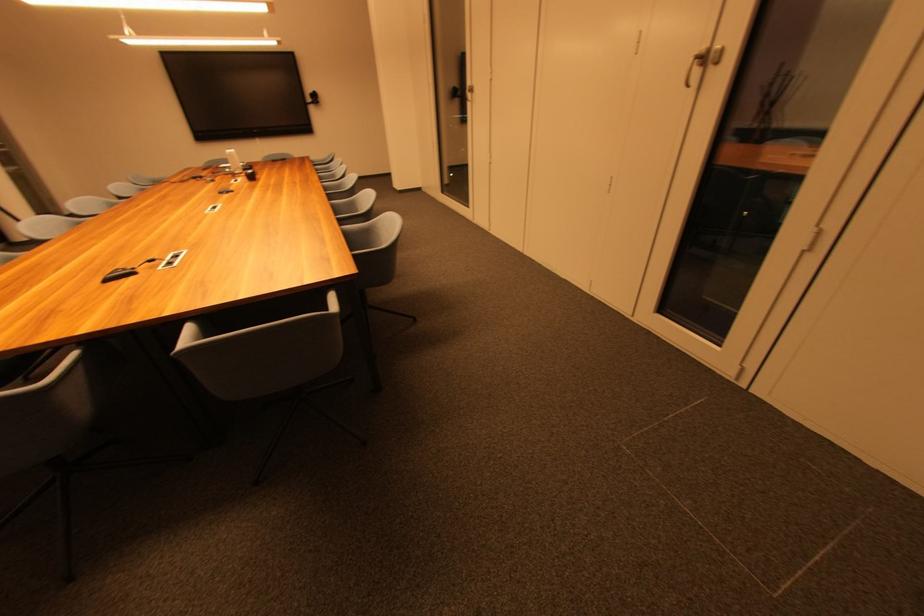
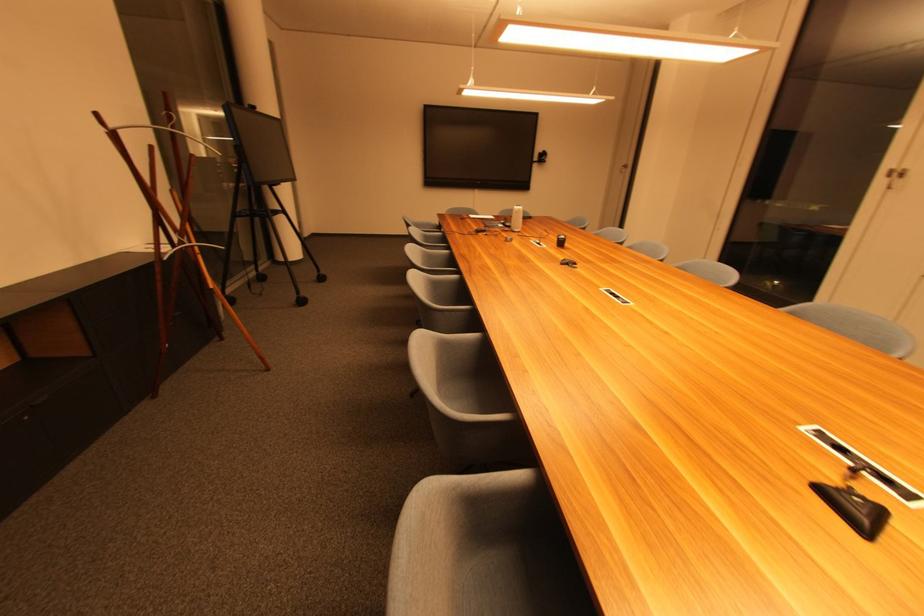
Find the pixel in the second image that matches [235,156] in the first image.

(521, 214)